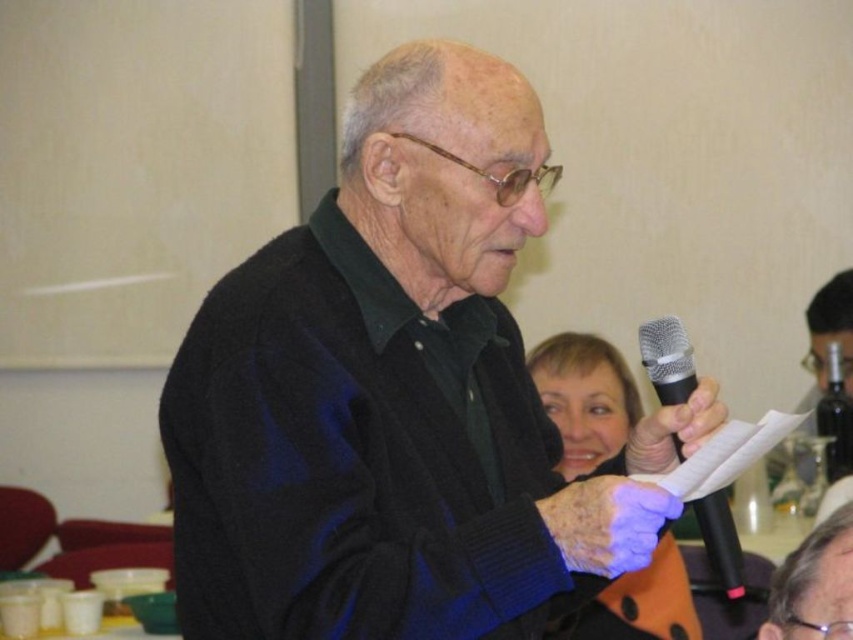
Based on the scene description, can you determine the spatial relationship between the smooth gray hair at upper center and the black metallic microphone at center? Please explain using their positions.

The smooth gray hair at upper center is located below the black metallic microphone at center, meaning the microphone is positioned above the hair in the image.

You are a photographer standing in front of the scene. You want to take a photo of the smooth gray hair at upper center and the black metallic microphone at center so that both are clearly visible. Given that your camera has a maximum focus range of 9 inches, will both objects be in focus?

The smooth gray hair at upper center and the black metallic microphone at center are 9.01 inches apart. Since the distance between them exceeds the camera maximum focus range of 9 inches, both objects will not be in focus simultaneously.

You are a fashion designer observing the scene. You need to decide which item, the black wool sweater at center or the purple leather glove at center, would require more fabric to create a similar size. Based on their sizes in the image, which one would you choose?

The black wool sweater at center is taller than the purple leather glove at center, so the black wool sweater at center would require more fabric to create a similar size.